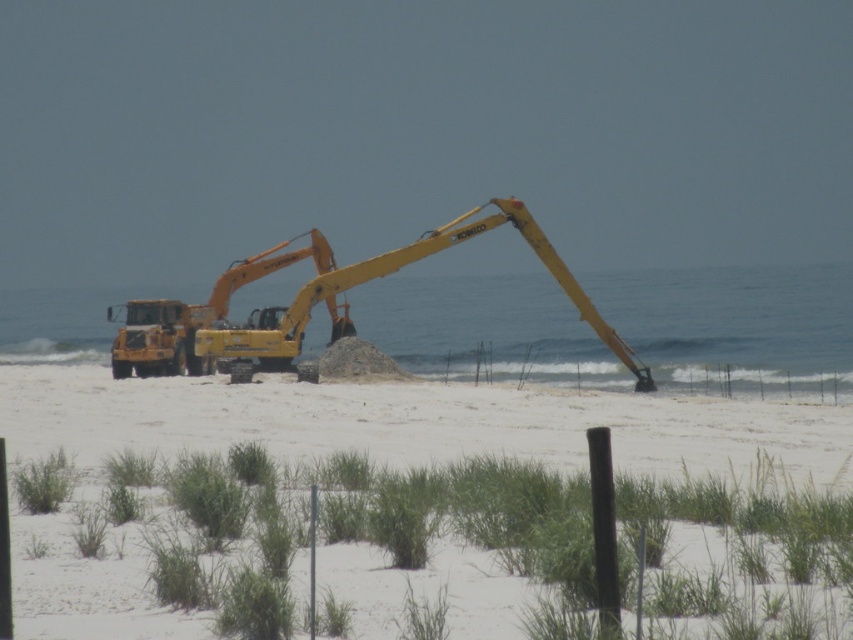
You are standing at the point with coordinates (413, 422) in the image. Based on the scene description, what type of terrain are you currently standing on?

The point at (413, 422) corresponds to the white sand beach at center, so you are standing on a white sand beach.

You are a construction worker on the beach and need to place a heavy equipment part on the white sand beach at center. The part must be placed above the yellow metallic excavator at center. Is this possible given their positions?

The white sand beach at center is located below the yellow metallic excavator at center, so placing the heavy equipment part above the yellow metallic excavator at center would not be possible since the beach is underneath it.

You are standing at the origin point in the image. Which direction should you move to reach the white sand beach at center?

The white sand beach at center is located at coordinates point (413, 422), so you should move towards the direction of increasing x and y coordinates to reach it.